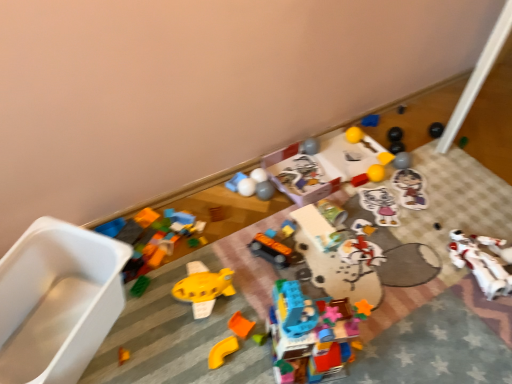
The height and width of the screenshot is (384, 512). What are the coordinates of `unoccupied space behind translucent plastic building blocks at center, which ranks as the ninth toy in right-to-left order` in the screenshot? It's located at (303, 276).